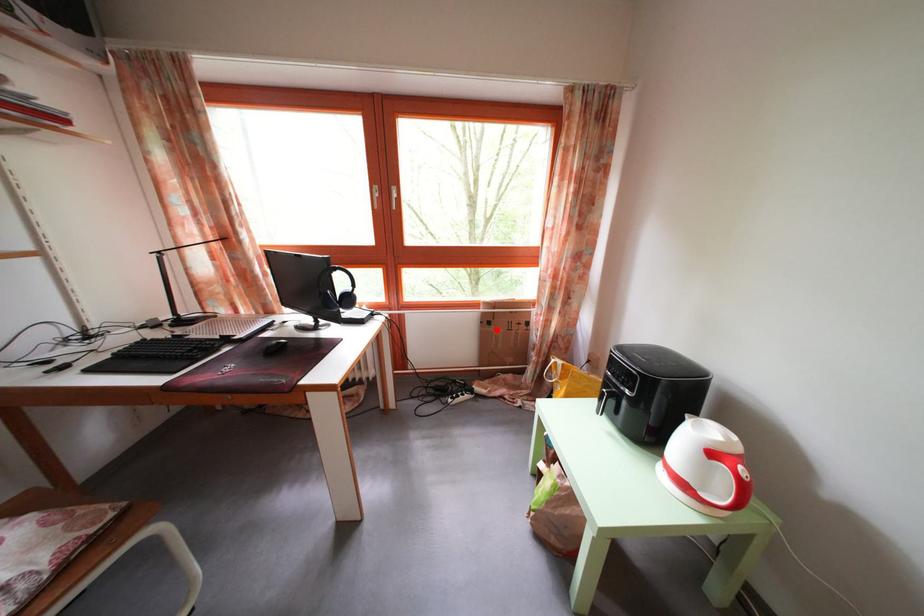
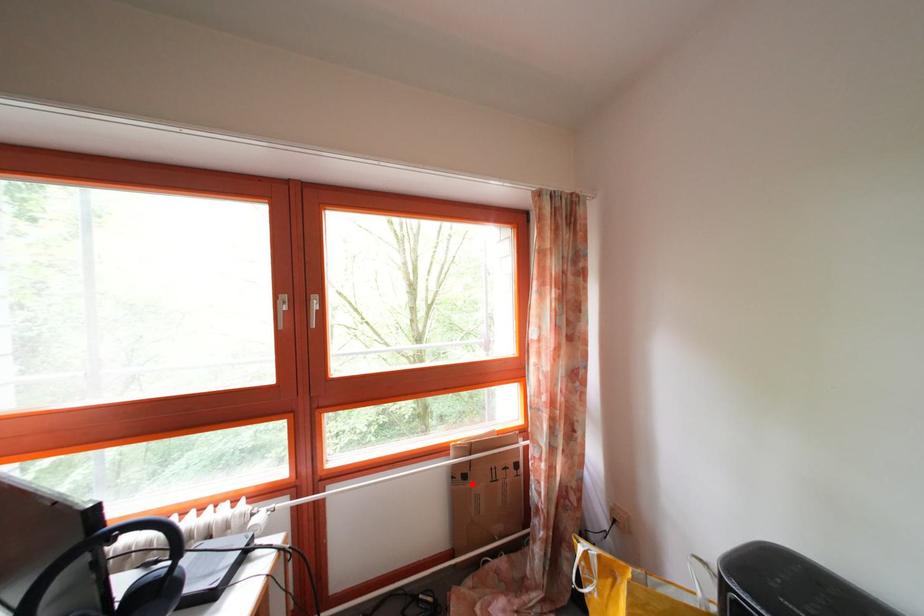
I am providing you with two images of the same scene from different viewpoints. A red point is marked on the first image and another point is marked on the second image. Does the point marked in image1 correspond to the same location as the one in image2?

Yes